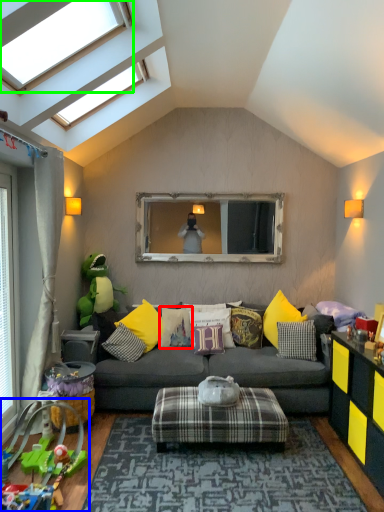
Question: Which is farther away from pillow (highlighted by a red box)? toy (highlighted by a blue box) or window (highlighted by a green box)?

Choices:
 (A) toy
 (B) window

Answer: (B)